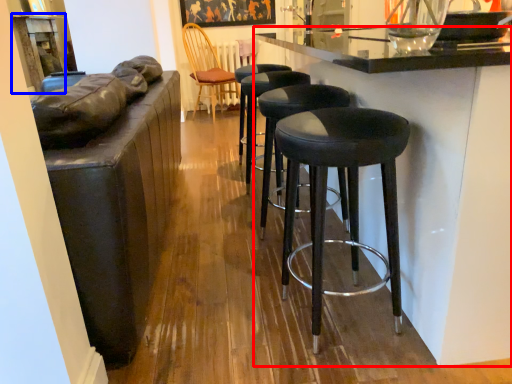
Question: Which point is closer to the camera, counter (highlighted by a red box) or table (highlighted by a blue box)?

Choices:
 (A) counter
 (B) table

Answer: (A)